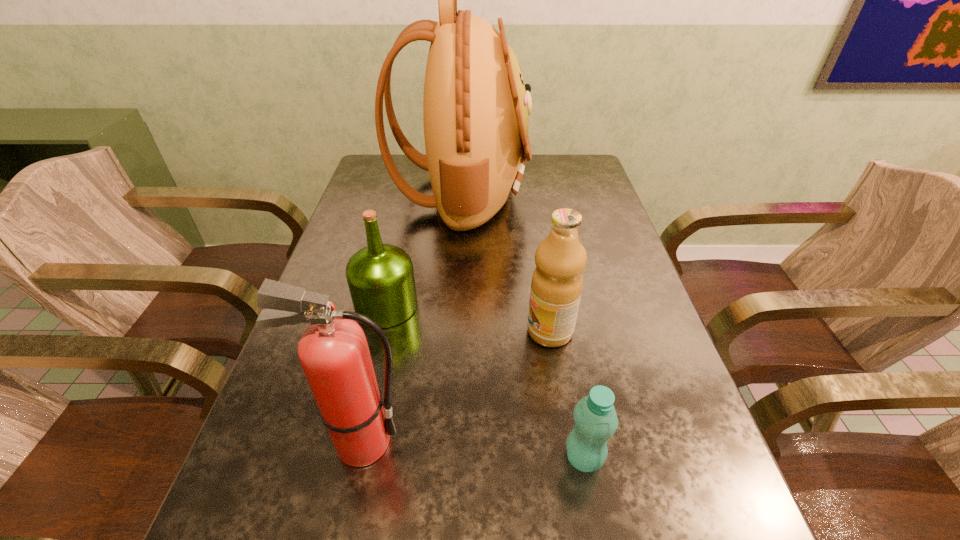
Find the location of `free region at the far edge`. free region at the far edge is located at coordinates (424, 188).

This screenshot has height=540, width=960. In the image, there is a desktop. Identify the location of vacant space at the left edge. pyautogui.click(x=400, y=195).

In the image, there is a desktop. Identify the location of free region at the right edge. [604, 239].

The width and height of the screenshot is (960, 540). What are the coordinates of `blank space at the far right corner` in the screenshot? It's located at (585, 169).

Locate an element on the screen. free space between the farthest object and the fire extinguisher is located at coordinates (411, 318).

You are a GUI agent. You are given a task and a screenshot of the screen. Output one action in this format:
    pyautogui.click(x=<x>, y=<y>)
    Task: Click on the vacant point located between the fire extinguisher and the taller olive oil
    The width and height of the screenshot is (960, 540).
    Given the screenshot: What is the action you would take?
    pyautogui.click(x=456, y=387)

At what (x,y) coordinates should I click in order to perform the action: click on free space that is in between the fourth tallest object and the shortest object. Please return your answer as a coordinate pair (x, y). Image resolution: width=960 pixels, height=540 pixels. Looking at the image, I should click on (485, 382).

At what (x,y) coordinates should I click in order to perform the action: click on vacant area between the farthest object and the shorter olive oil. Please return your answer as a coordinate pair (x, y). The height and width of the screenshot is (540, 960). Looking at the image, I should click on (423, 249).

Where is `free point between the tallest object and the fire extinguisher`? The image size is (960, 540). free point between the tallest object and the fire extinguisher is located at coordinates (411, 318).

The height and width of the screenshot is (540, 960). In order to click on blank region between the second tallest object and the backpack in this screenshot , I will do `click(411, 318)`.